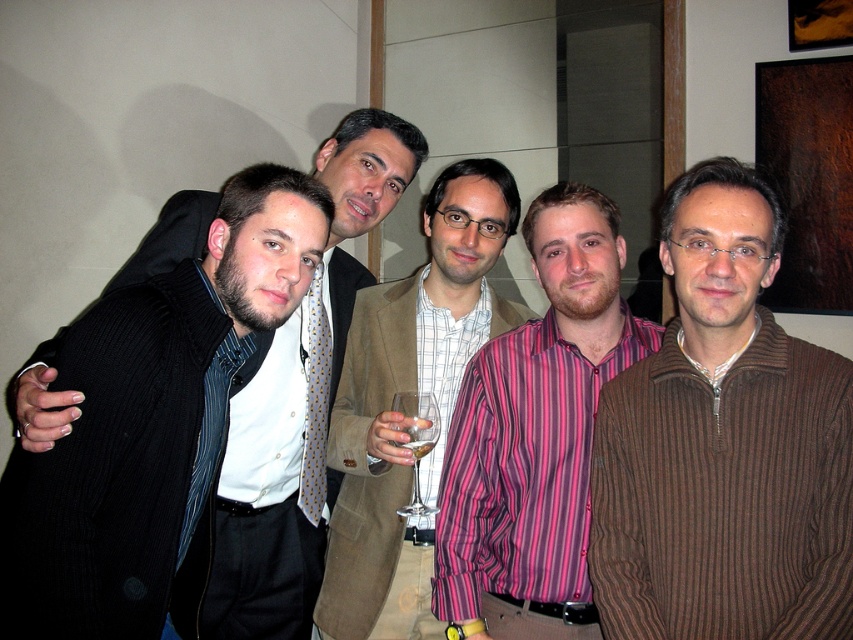
Question: Is striped cotton shirt at center positioned in front of light brown textured blazer at center?

Choices:
 (A) yes
 (B) no

Answer: (A)

Question: Is clear glass wine glass at center in front of clear glass wine at center?

Choices:
 (A) no
 (B) yes

Answer: (B)

Question: Which point is farther to the camera?

Choices:
 (A) (519, 456)
 (B) (431, 449)

Answer: (B)

Question: Can you confirm if matte black sweater at left is positioned to the left of clear glass wine at center?

Choices:
 (A) yes
 (B) no

Answer: (A)

Question: Which of these objects is positioned closest to the matte black sweater at left?

Choices:
 (A) brown ribbed sweater at right
 (B) clear glass wine glass at center
 (C) striped cotton shirt at center

Answer: (B)

Question: Which of the following is the farthest from the observer?

Choices:
 (A) pos(422,440)
 (B) pos(424,224)
 (C) pos(424,396)

Answer: (B)